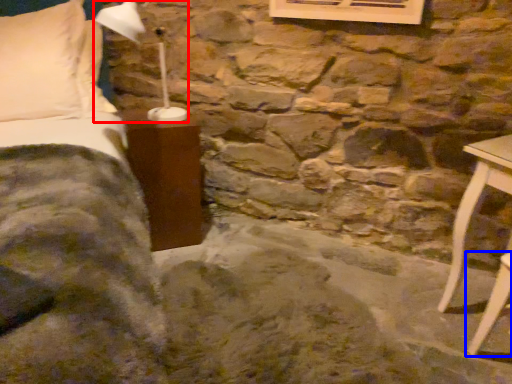
Question: Which point is further to the camera, table lamp (highlighted by a red box) or furniture (highlighted by a blue box)?

Choices:
 (A) table lamp
 (B) furniture

Answer: (A)